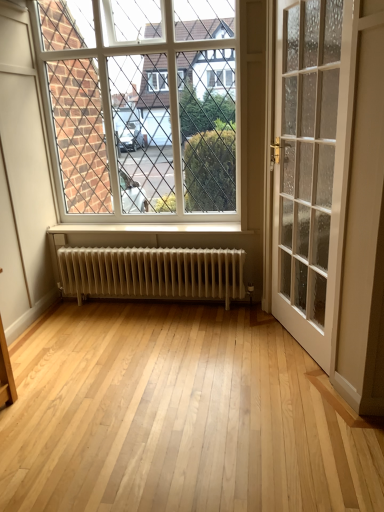
This screenshot has height=512, width=384. Find the location of `free space in front of white glass door at right`. free space in front of white glass door at right is located at coordinates (290, 391).